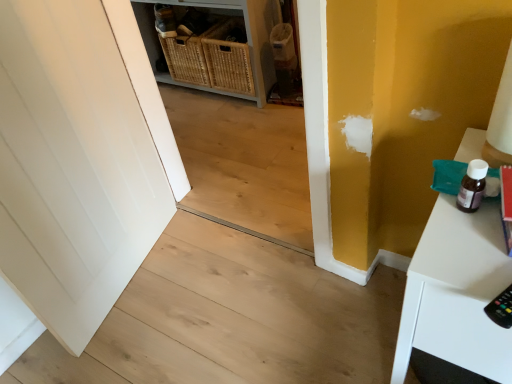
Question: From a real-world perspective, is natural wood stair at center above or below white glossy table at right?

Choices:
 (A) above
 (B) below

Answer: (B)

Question: Based on their sizes in the image, would you say natural wood stair at center is bigger or smaller than white glossy table at right?

Choices:
 (A) small
 (B) big

Answer: (A)

Question: Estimate the real-world distances between objects in this image. Which object is farther from the natural wood stair at center?

Choices:
 (A) white glossy table at right
 (B) woven wicker baskets at center

Answer: (B)

Question: Which object is positioned closest to the white glossy table at right?

Choices:
 (A) natural wood stair at center
 (B) woven wicker baskets at center

Answer: (A)